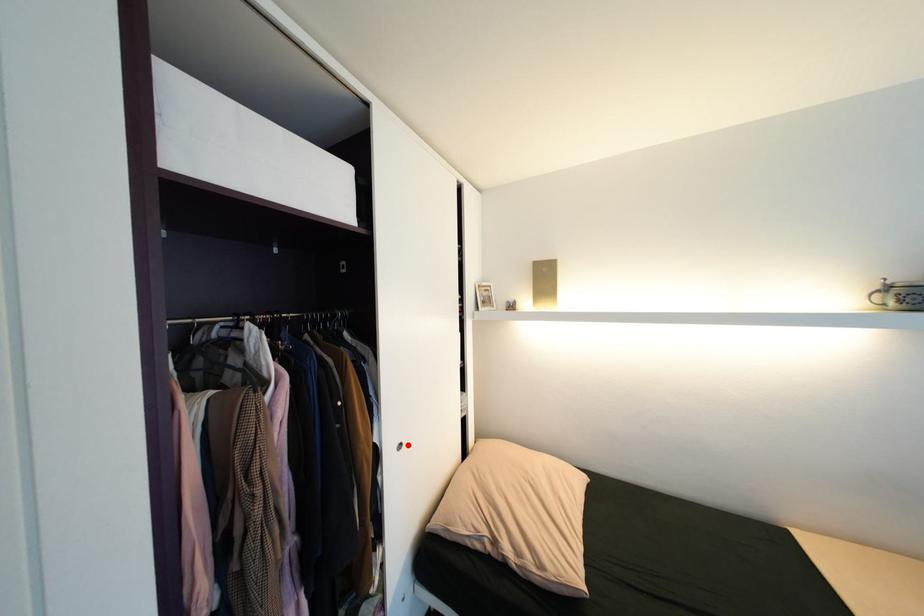
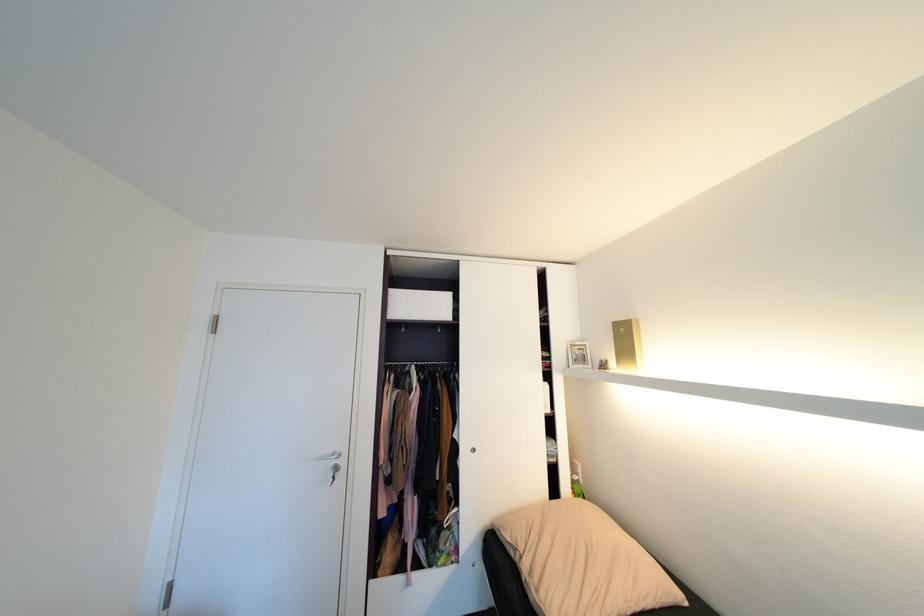
In the second image, find the point that corresponds to the highlighted location in the first image.

(481, 450)